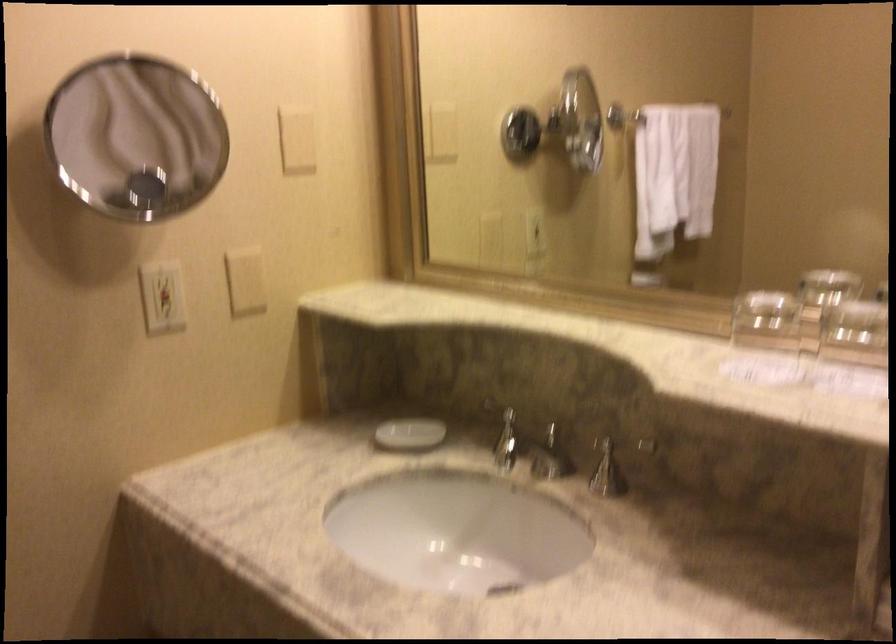
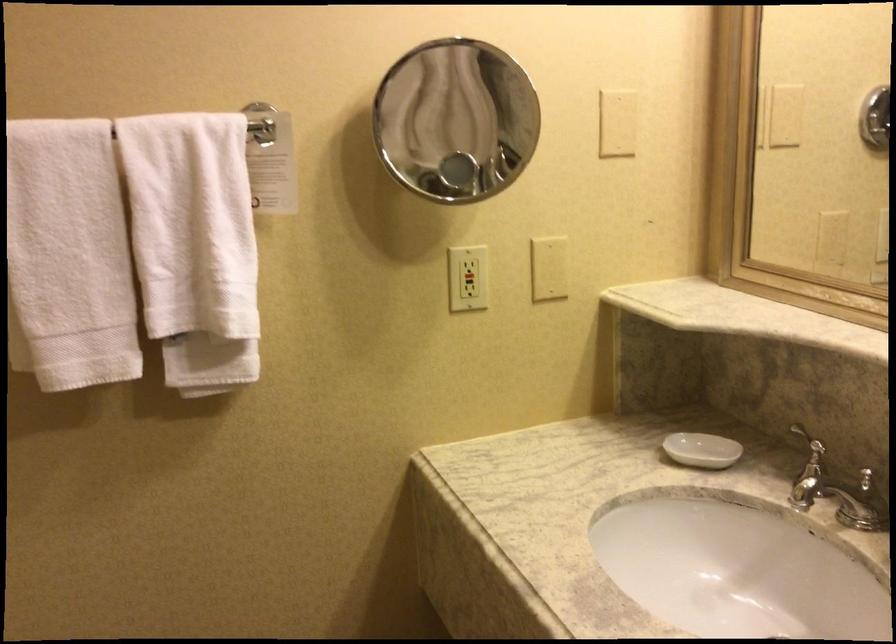
Question: The camera is either moving clockwise (left) or counter-clockwise (right) around the object. The first image is from the beginning of the video and the second image is from the end. Is the camera moving left or right when shooting the video?

Choices:
 (A) Left
 (B) Right

Answer: (B)